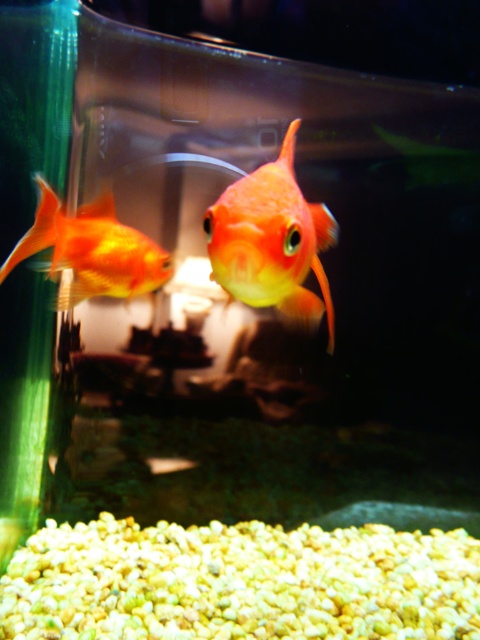
Question: Considering the relative positions of shiny orange goldfish at center and matte orange goldfish at left in the image provided, where is shiny orange goldfish at center located with respect to matte orange goldfish at left?

Choices:
 (A) below
 (B) above

Answer: (A)

Question: Does shiny orange goldfish at center appear on the left side of matte orange goldfish at left?

Choices:
 (A) no
 (B) yes

Answer: (A)

Question: Which point is closer to the camera taking this photo?

Choices:
 (A) [x=283, y=256]
 (B) [x=7, y=273]

Answer: (A)

Question: From the image, what is the correct spatial relationship of shiny orange goldfish at center in relation to matte orange goldfish at left?

Choices:
 (A) below
 (B) above

Answer: (A)

Question: Which of the following is the closest to the observer?

Choices:
 (A) (43, 208)
 (B) (271, 209)

Answer: (B)

Question: Which object appears farthest from the camera in this image?

Choices:
 (A) shiny orange goldfish at center
 (B) matte orange goldfish at left

Answer: (B)